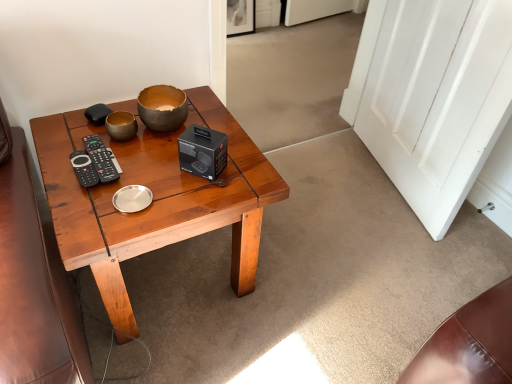
Find the location of a particular element. Image resolution: width=512 pixels, height=384 pixels. free point below wooden coffee table at center (from a real-world perspective) is located at coordinates (180, 279).